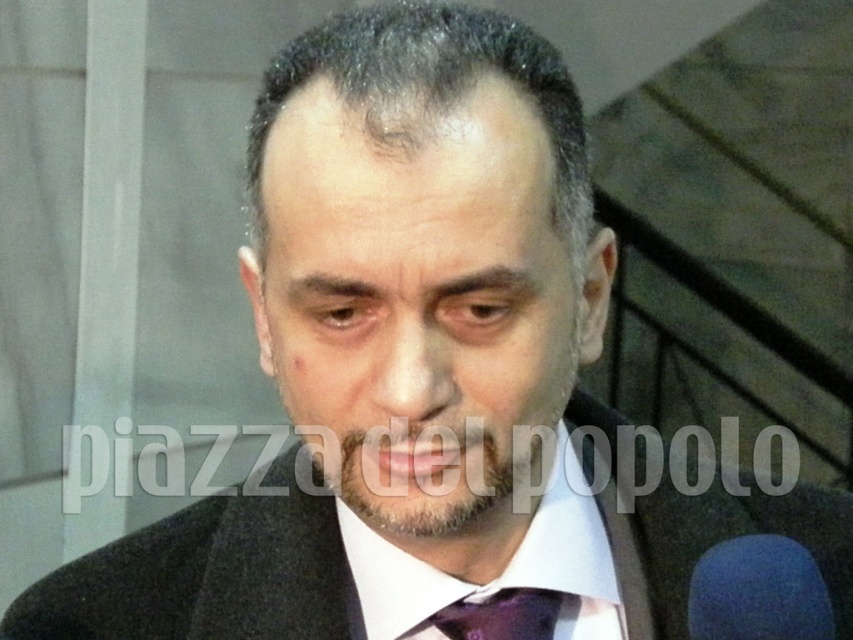
Can you confirm if dark gray wool suit at center is positioned to the left of purple satin tie at center?

Correct, you'll find dark gray wool suit at center to the left of purple satin tie at center.

Is point (646, 577) behind point (544, 636)?

Yes, it is behind point (544, 636).

Who is more distant from viewer, [280,609] or [514,596]?

The point [514,596] is more distant.

I want to click on dark gray wool suit at center, so click(202, 577).

Is point (387, 184) farther from viewer compared to point (318, 561)?

No.

In the scene shown: Does smooth skin face at center have a greater width compared to dark gray wool suit at center?

No.

Measure the distance between smooth skin face at center and camera.

14.43 inches

The image size is (853, 640). Identify the location of smooth skin face at center. (415, 300).

At what (x,y) coordinates should I click in order to perform the action: click on smooth skin face at center. Please return your answer as a coordinate pair (x, y). This screenshot has width=853, height=640. Looking at the image, I should click on (415, 300).

Who is more distant from viewer, (373,241) or (514,627)?

Point (514,627)

The image size is (853, 640). In order to click on smooth skin face at center in this screenshot , I will do `click(415, 300)`.